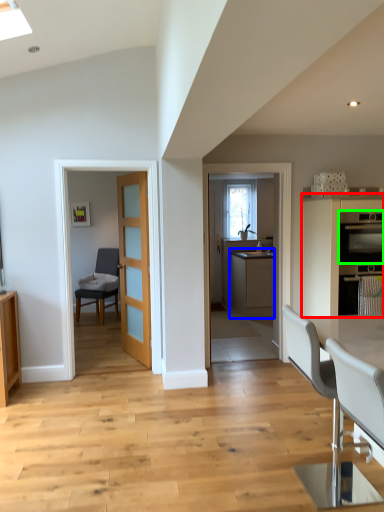
Question: Which object is positioned farthest from cabinetry (highlighted by a red box)? Select from cabinetry (highlighted by a blue box) and kitchen appliance (highlighted by a green box).

Choices:
 (A) cabinetry
 (B) kitchen appliance

Answer: (A)